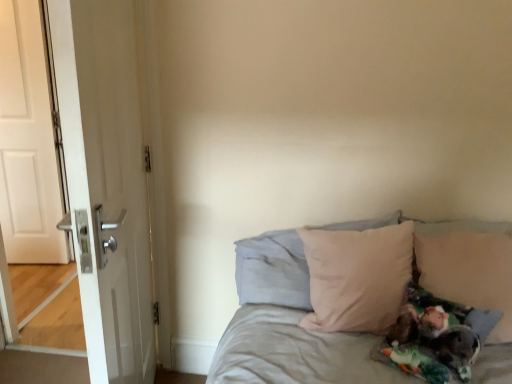
Question: Considering the relative positions of beige fabric bed at center and white matte door at left, placed as the 1th door when sorted from left to right, in the image provided, is beige fabric bed at center to the right of white matte door at left, placed as the 1th door when sorted from left to right, from the viewer's perspective?

Choices:
 (A) yes
 (B) no

Answer: (A)

Question: From the image's perspective, is beige fabric bed at center beneath white matte door at left, the second door when ordered from front to back?

Choices:
 (A) yes
 (B) no

Answer: (A)

Question: Is beige fabric bed at center not near white matte door at left, placed as the 1th door when sorted from left to right?

Choices:
 (A) yes
 (B) no

Answer: (A)

Question: Is beige fabric bed at center wider than white matte door at left, the first door positioned from the back?

Choices:
 (A) no
 (B) yes

Answer: (B)

Question: From a real-world perspective, is beige fabric bed at center physically below white matte door at left, placed as the 1th door when sorted from left to right?

Choices:
 (A) no
 (B) yes

Answer: (B)

Question: Is beige fabric bed at center thinner than white matte door at left, the first door positioned from the back?

Choices:
 (A) no
 (B) yes

Answer: (A)

Question: From a real-world perspective, is white glossy door at left, the 1th door viewed from the front, positioned under beige fabric pillow at right, arranged as the 1th pillow when viewed from the right, based on gravity?

Choices:
 (A) yes
 (B) no

Answer: (B)

Question: Is white glossy door at left, the 1th door viewed from the front, thinner than beige fabric pillow at right, arranged as the 1th pillow when viewed from the right?

Choices:
 (A) yes
 (B) no

Answer: (A)

Question: Are white glossy door at left, the 1th door viewed from the right, and beige fabric pillow at right, the second pillow when ordered from left to right, located far from each other?

Choices:
 (A) yes
 (B) no

Answer: (A)

Question: Does white glossy door at left, the 1th door viewed from the right, appear on the right side of beige fabric pillow at right, the second pillow when ordered from left to right?

Choices:
 (A) no
 (B) yes

Answer: (A)

Question: Considering the relative sizes of white glossy door at left, which is the second door in left-to-right order, and beige fabric pillow at right, arranged as the 1th pillow when viewed from the right, in the image provided, is white glossy door at left, which is the second door in left-to-right order, shorter than beige fabric pillow at right, arranged as the 1th pillow when viewed from the right,?

Choices:
 (A) no
 (B) yes

Answer: (A)

Question: Is white glossy door at left, which is the second door in left-to-right order, facing towards beige fabric pillow at right, arranged as the 1th pillow when viewed from the right?

Choices:
 (A) yes
 (B) no

Answer: (B)

Question: Is white glossy door at left, which is the second door in left-to-right order, with beige fabric pillow at center, the 1th pillow in the left-to-right sequence?

Choices:
 (A) yes
 (B) no

Answer: (B)